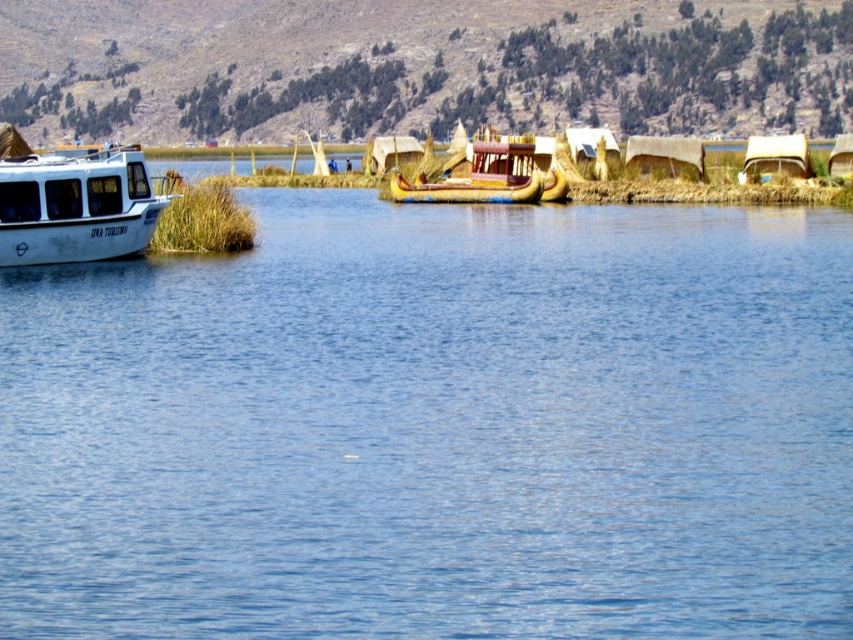
Question: Is blue water at center to the left of white matte boat at left from the viewer's perspective?

Choices:
 (A) yes
 (B) no

Answer: (B)

Question: Estimate the real-world distances between objects in this image. Which object is closer to the white matte boat at left?

Choices:
 (A) golden woven reed boat at center
 (B) blue water at center

Answer: (B)

Question: Is white matte boat at left to the right of golden woven reed boat at center from the viewer's perspective?

Choices:
 (A) no
 (B) yes

Answer: (A)

Question: Can you confirm if blue water at center is wider than white matte boat at left?

Choices:
 (A) yes
 (B) no

Answer: (A)

Question: Which of the following is the farthest from the observer?

Choices:
 (A) white matte boat at left
 (B) blue water at center

Answer: (A)

Question: Which of the following is the farthest from the observer?

Choices:
 (A) (671, 536)
 (B) (531, 182)
 (C) (61, 189)

Answer: (B)